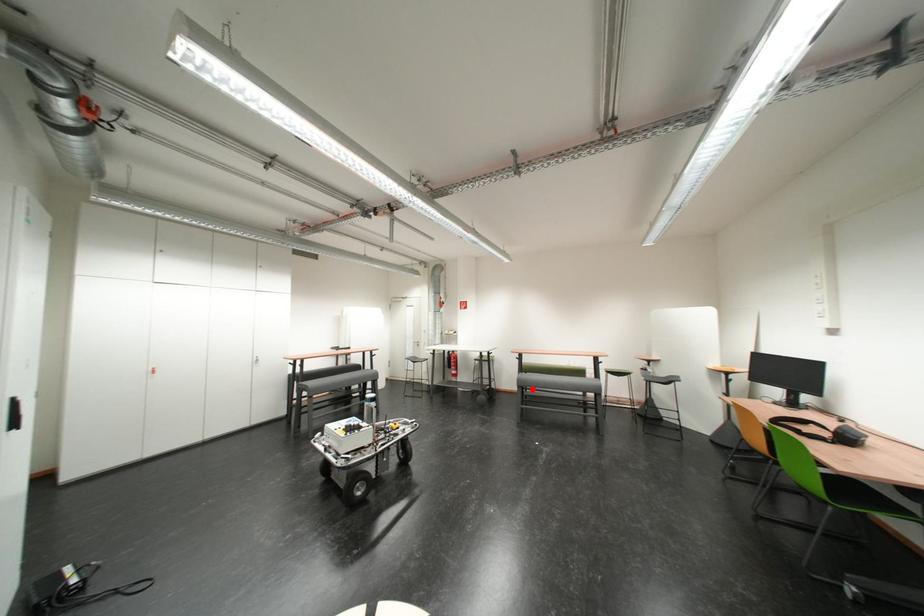
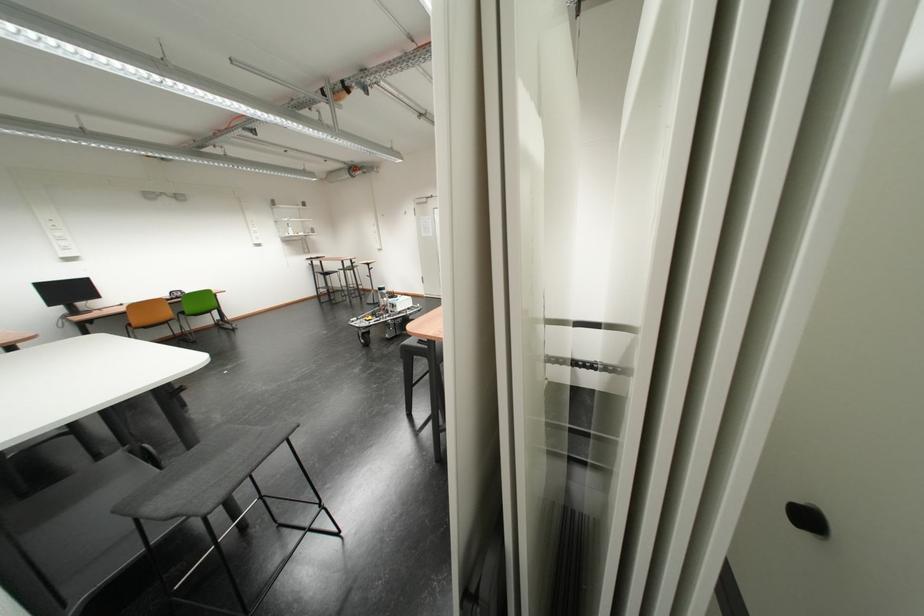
Question: I am providing you with two images of the same scene from different viewpoints. A red point is marked on the first image. Can you still see the location of the red point in image 2?

Choices:
 (A) Yes
 (B) No

Answer: (B)